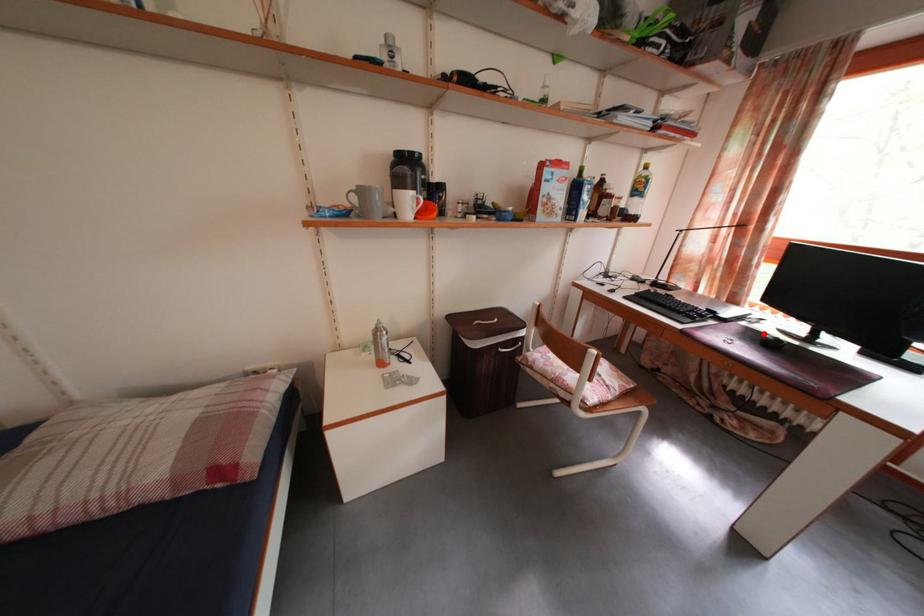
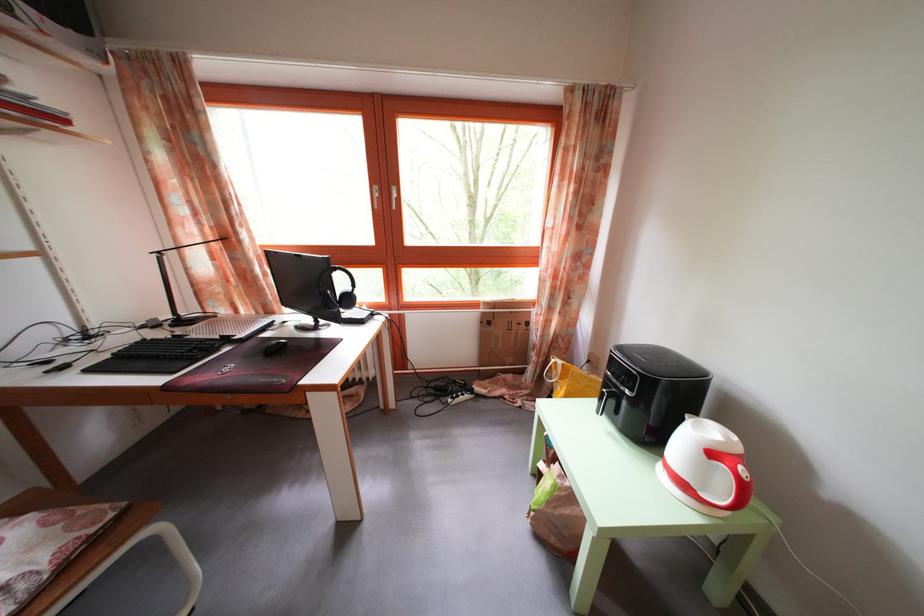
Question: I am providing you with two images of the same scene from different viewpoints. A red point is marked on the first image. Is the red point's position out of view in image 2?

Choices:
 (A) Yes
 (B) No

Answer: (A)